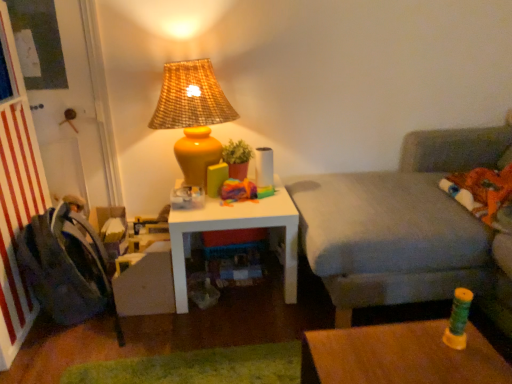
Where is `white matte table at center`? This screenshot has height=384, width=512. white matte table at center is located at coordinates (237, 228).

The image size is (512, 384). What do you see at coordinates (237, 228) in the screenshot?
I see `white matte table at center` at bounding box center [237, 228].

This screenshot has width=512, height=384. What do you see at coordinates (193, 116) in the screenshot?
I see `matte yellow vase at upper center` at bounding box center [193, 116].

The width and height of the screenshot is (512, 384). What do you see at coordinates (66, 267) in the screenshot? I see `dark gray fabric swivel chair at left` at bounding box center [66, 267].

Measure the distance between point [485,139] and camera.

The depth of point [485,139] is 2.38 meters.

You are a GUI agent. You are given a task and a screenshot of the screen. Output one action in this format:
    pyautogui.click(x=<x>, y=<y>)
    Task: Click on the white matte table at center
    The width and height of the screenshot is (512, 384).
    Given the screenshot: What is the action you would take?
    pyautogui.click(x=237, y=228)

From a real-world perspective, is white matte table at center above or below matte yellow vase at upper center?

In terms of real-world spatial position, white matte table at center is below matte yellow vase at upper center.

Considering the relative sizes of white matte table at center and matte yellow vase at upper center in the image provided, is white matte table at center bigger than matte yellow vase at upper center?

Indeed, white matte table at center has a larger size compared to matte yellow vase at upper center.

What's the angular difference between white matte table at center and matte yellow vase at upper center's facing directions?

They differ by 0.000644 degrees in their facing directions.

Are dark gray fabric swivel chair at left and gray fabric couch at right making contact?

dark gray fabric swivel chair at left is not next to gray fabric couch at right, and they're not touching.

Is dark gray fabric swivel chair at left facing towards gray fabric couch at right?

Yes.

From the image's perspective, is dark gray fabric swivel chair at left positioned above or below gray fabric couch at right?

Clearly, from the image's perspective, dark gray fabric swivel chair at left is below gray fabric couch at right.

How far apart are dark gray fabric swivel chair at left and gray fabric couch at right?

dark gray fabric swivel chair at left and gray fabric couch at right are 1.16 meters apart.

Which is less distant, (474, 231) or (209, 85)?

The point (474, 231) is closer.

From the picture: How different are the orientations of gray fabric couch at right and matte yellow vase at upper center in degrees?

88.3 degrees separate the facing orientations of gray fabric couch at right and matte yellow vase at upper center.

How distant is gray fabric couch at right from matte yellow vase at upper center?

They are 30.10 inches apart.

Who is bigger, gray fabric couch at right or matte yellow vase at upper center?

With larger size is gray fabric couch at right.

What's the angular difference between matte yellow vase at upper center and gray fabric couch at right's facing directions?

The facing directions of matte yellow vase at upper center and gray fabric couch at right are 88.3 degrees apart.

Considering the relative positions of matte yellow vase at upper center and gray fabric couch at right in the image provided, is matte yellow vase at upper center behind gray fabric couch at right?

Yes.

Are matte yellow vase at upper center and gray fabric couch at right far apart?

That's not correct — matte yellow vase at upper center is a little close to gray fabric couch at right.

At what (x,y) coordinates should I click in order to perform the action: click on lamp above the gray fabric couch at right (from the image's perspective). Please return your answer as a coordinate pair (x, y). This screenshot has height=384, width=512. Looking at the image, I should click on (193, 116).

Is the depth of dark gray fabric swivel chair at left less than that of white matte table at center?

Yes, dark gray fabric swivel chair at left is closer to the camera.

Are dark gray fabric swivel chair at left and white matte table at center located far from each other?

dark gray fabric swivel chair at left is actually quite close to white matte table at center.

Looking at their sizes, would you say dark gray fabric swivel chair at left is wider or thinner than white matte table at center?

Clearly, dark gray fabric swivel chair at left has less width compared to white matte table at center.

Is dark gray fabric swivel chair at left at the right side of white matte table at center?

In fact, dark gray fabric swivel chair at left is to the left of white matte table at center.

Considering the relative sizes of white matte table at center and dark gray fabric swivel chair at left in the image provided, is white matte table at center smaller than dark gray fabric swivel chair at left?

No, white matte table at center is not smaller than dark gray fabric swivel chair at left.

Is white matte table at center not close to dark gray fabric swivel chair at left?

No, white matte table at center is not far from dark gray fabric swivel chair at left.

Is white matte table at center facing away from dark gray fabric swivel chair at left?

That's not correct — white matte table at center is not looking away from dark gray fabric swivel chair at left.

Who is more distant, white matte table at center or dark gray fabric swivel chair at left?

white matte table at center.

Looking at the image, does dark gray fabric swivel chair at left seem bigger or smaller compared to matte yellow vase at upper center?

Considering their sizes, dark gray fabric swivel chair at left takes up less space than matte yellow vase at upper center.

Which object is wider, dark gray fabric swivel chair at left or matte yellow vase at upper center?

matte yellow vase at upper center.

Consider the image. From their relative heights in the image, would you say dark gray fabric swivel chair at left is taller or shorter than matte yellow vase at upper center?

Clearly, dark gray fabric swivel chair at left is shorter compared to matte yellow vase at upper center.

From a real-world perspective, is dark gray fabric swivel chair at left on matte yellow vase at upper center?

No.

In the image, there is a matte yellow vase at upper center. Where is `table below it (from a real-world perspective)`? This screenshot has width=512, height=384. table below it (from a real-world perspective) is located at coordinates pos(237,228).

What are the coordinates of `studio couch above the dark gray fabric swivel chair at left (from the image's perspective)` in the screenshot? It's located at (400, 224).

When comparing their distances from white matte table at center, does matte yellow vase at upper center or gray fabric couch at right seem further?

gray fabric couch at right.

Consider the image. Estimate the real-world distances between objects in this image. Which object is closer to dark gray fabric swivel chair at left, white matte table at center or matte yellow vase at upper center?

Based on the image, white matte table at center appears to be nearer to dark gray fabric swivel chair at left.

Considering their positions, is dark gray fabric swivel chair at left positioned closer to white matte table at center than matte yellow vase at upper center?

matte yellow vase at upper center.

When comparing their distances from white matte table at center, does matte yellow vase at upper center or dark gray fabric swivel chair at left seem further?

dark gray fabric swivel chair at left is positioned further to the anchor white matte table at center.

Considering their positions, is gray fabric couch at right positioned further to dark gray fabric swivel chair at left than white matte table at center?

gray fabric couch at right lies further to dark gray fabric swivel chair at left than the other object.

From the image, which object appears to be farther from dark gray fabric swivel chair at left, matte yellow vase at upper center or white matte table at center?

matte yellow vase at upper center lies further to dark gray fabric swivel chair at left than the other object.

Which object lies nearer to the anchor point gray fabric couch at right, matte yellow vase at upper center or dark gray fabric swivel chair at left?

The object closer to gray fabric couch at right is matte yellow vase at upper center.

When comparing their distances from gray fabric couch at right, does dark gray fabric swivel chair at left or white matte table at center seem further?

dark gray fabric swivel chair at left lies further to gray fabric couch at right than the other object.

Identify the location of lamp between dark gray fabric swivel chair at left and white matte table at center in the horizontal direction. (193, 116).

Where is `table between dark gray fabric swivel chair at left and gray fabric couch at right`? table between dark gray fabric swivel chair at left and gray fabric couch at right is located at coordinates (237, 228).

Where is `table between matte yellow vase at upper center and gray fabric couch at right in the horizontal direction`? table between matte yellow vase at upper center and gray fabric couch at right in the horizontal direction is located at coordinates (237, 228).

The image size is (512, 384). What are the coordinates of `lamp between dark gray fabric swivel chair at left and gray fabric couch at right in the horizontal direction` in the screenshot? It's located at (193, 116).